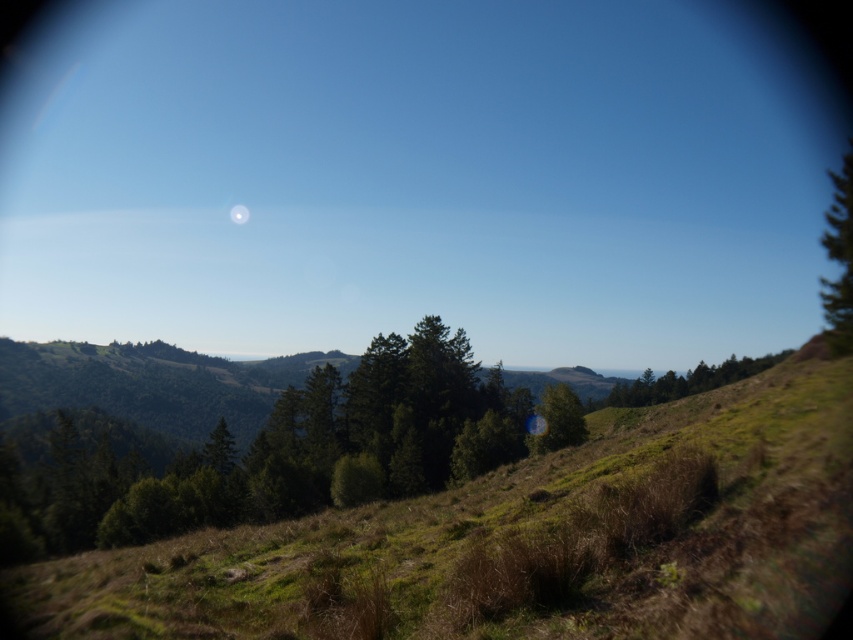
Is the position of green grassy hillside at center less distant than that of white glossy moon at upper center?

Yes.

Is point (352, 611) more distant than point (242, 211)?

No.

Locate an element on the screen. green grassy hillside at center is located at coordinates (521, 541).

Can you confirm if green matte tree at upper right is thinner than green matte tree at center?

Incorrect, green matte tree at upper right's width is not less than green matte tree at center's.

Does green matte tree at upper right appear under green matte tree at center?

Correct, green matte tree at upper right is located below green matte tree at center.

Between point (593, 408) and point (583, 440), which one is positioned in front?

Point (583, 440) is more forward.

Image resolution: width=853 pixels, height=640 pixels. What are the coordinates of `green matte tree at upper right` in the screenshot? It's located at (683, 381).

Is green textured tree at center smaller than green matte tree at center?

Incorrect, green textured tree at center is not smaller in size than green matte tree at center.

Is point (822, 234) farther from viewer compared to point (564, 435)?

Yes, it is.

The height and width of the screenshot is (640, 853). I want to click on green textured tree at center, so click(x=839, y=260).